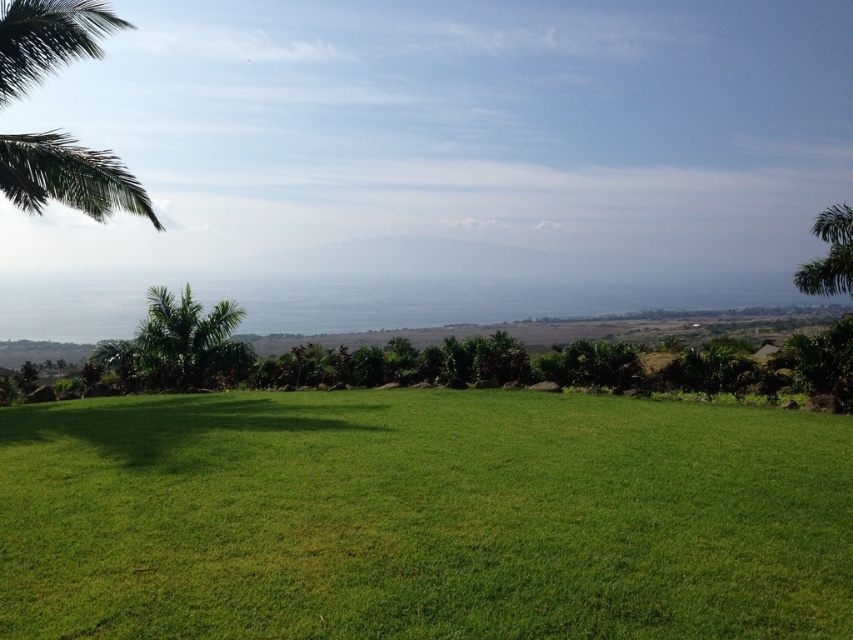
Looking at this image, you are standing in the middle of the grassy area and want to walk towards the palm trees. Which direction should you walk to reach the green leafy palm at upper left and the green leafy palm tree at lower left first?

To reach the green leafy palm at upper left first, walk towards the upper left direction. To reach the green leafy palm tree at lower left first, walk towards the lower left direction.

You are standing at the point labeled point (166, 346) and want to walk towards the point labeled point (840, 208). Based on the scene description, will you have an unobstructed path? Explain your reasoning.

The point labeled point (166, 346) is in front of point (840, 208). Since the foreground has a well maintained grassy area, there are no obstructions between them. Therefore, you will have an unobstructed path.